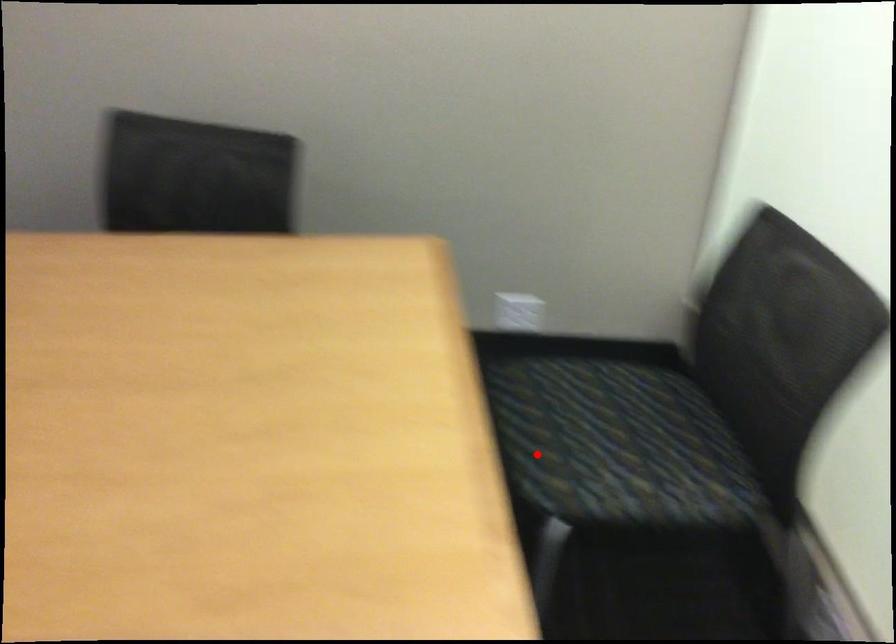
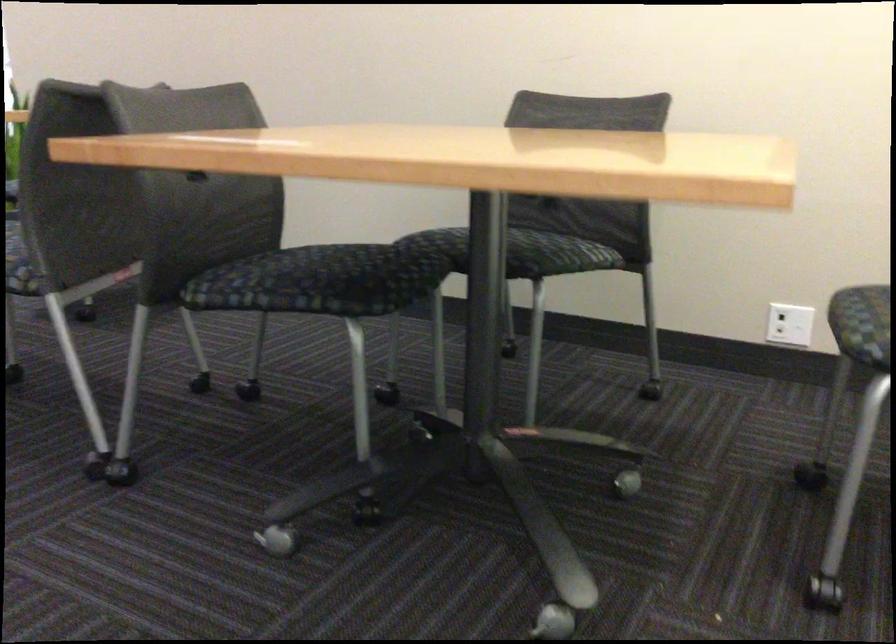
Question: I am providing you with two images of the same scene from different viewpoints. Given a red point in image1, look at the same physical point in image2. Is it:

Choices:
 (A) Closer to the viewpoint
 (B) Farther from the viewpoint

Answer: (A)